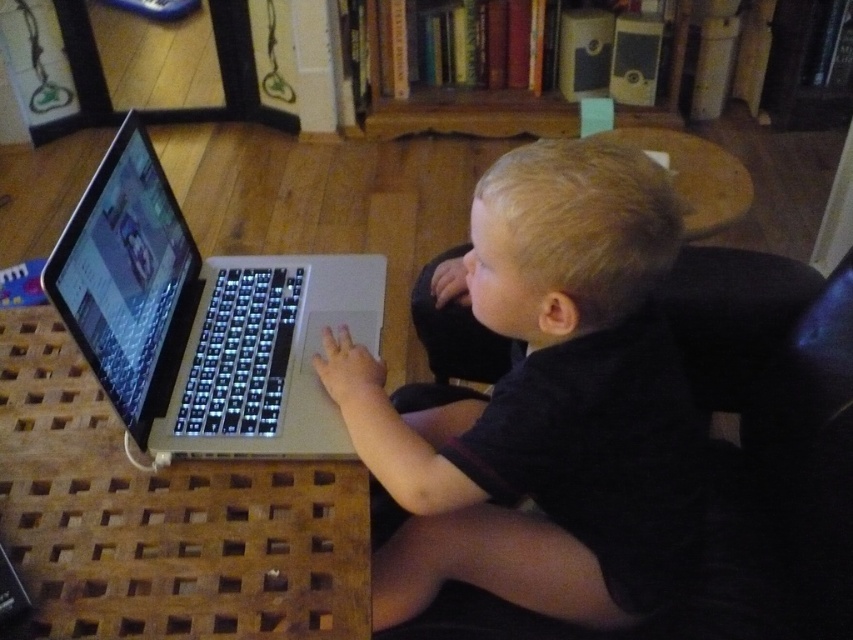
Question: Which point is closer to the camera?

Choices:
 (A) wooden bookshelf at upper center
 (B) black matte laptop at lower left

Answer: (B)

Question: In this image, where is black matte laptop at lower left located relative to silver metallic laptop at lower left?

Choices:
 (A) above
 (B) below

Answer: (B)

Question: Which object appears closest to the camera in this image?

Choices:
 (A) wooden bookshelf at upper center
 (B) black fabric chair at right
 (C) black matte laptop at lower left

Answer: (C)

Question: Where is black matte laptop at lower left located in relation to black fabric chair at right in the image?

Choices:
 (A) right
 (B) left

Answer: (B)

Question: Which is farther from the black matte laptop at lower left?

Choices:
 (A) black fabric chair at right
 (B) wooden bookshelf at upper center
 (C) silver metallic laptop at lower left

Answer: (B)

Question: Does silver metallic laptop at lower left have a lesser width compared to wooden bookshelf at upper center?

Choices:
 (A) no
 (B) yes

Answer: (B)